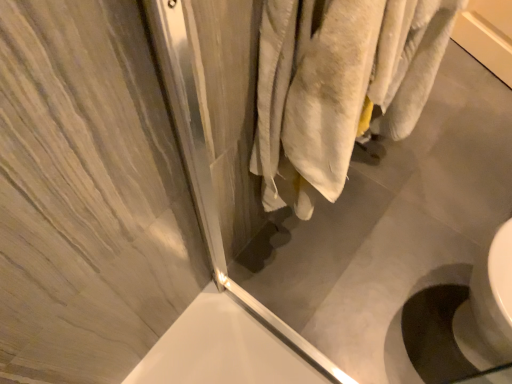
At what (x,y) coordinates should I click in order to perform the action: click on vacant space to the right of translucent glass screen door at upper right. Please return your answer as a coordinate pair (x, y). Looking at the image, I should click on tap(365, 310).